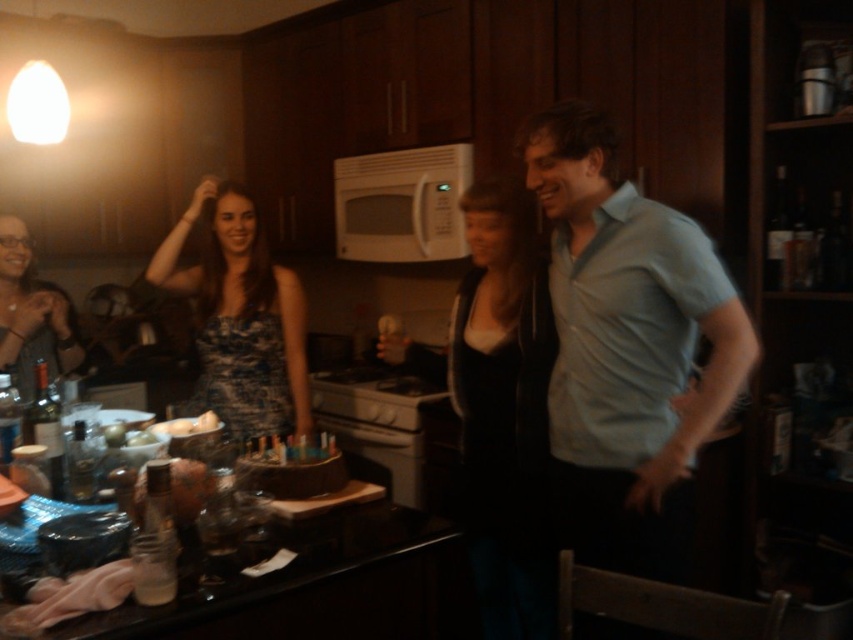
Does black leather jacket at center have a smaller size compared to blue printed dress at center?

Actually, black leather jacket at center might be larger than blue printed dress at center.

Does point (489, 602) lie behind point (256, 426)?

That is False.

At what (x,y) coordinates should I click in order to perform the action: click on black leather jacket at center. Please return your answer as a coordinate pair (x, y). The image size is (853, 640). Looking at the image, I should click on (500, 408).

Is the position of black leather jacket at center less distant than that of translucent glass bottle at left?

No, it is behind translucent glass bottle at left.

Who is more distant from viewer, (519, 275) or (61, 484)?

The point (519, 275) is more distant.

Is point (521, 536) less distant than point (57, 429)?

No, it is behind (57, 429).

Where is `black leather jacket at center`? black leather jacket at center is located at coordinates (500, 408).

Is light blue cotton shirt at right smaller than black leather jacket at center?

Yes.

Can you confirm if light blue cotton shirt at right is positioned to the left of black leather jacket at center?

In fact, light blue cotton shirt at right is to the right of black leather jacket at center.

Who is more forward, (621, 499) or (488, 472)?

Positioned in front is point (621, 499).

You are a GUI agent. You are given a task and a screenshot of the screen. Output one action in this format:
    pyautogui.click(x=<x>, y=<y>)
    Task: Click on the light blue cotton shirt at right
    Image resolution: width=853 pixels, height=640 pixels.
    Given the screenshot: What is the action you would take?
    click(627, 348)